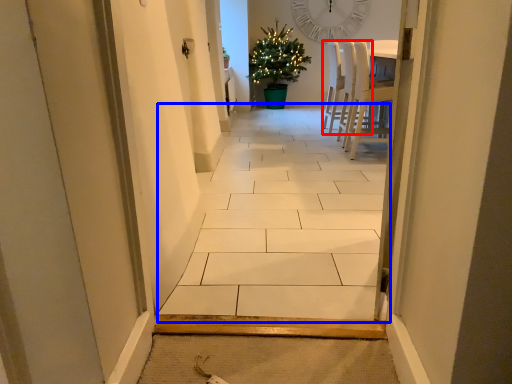
Question: Among these objects, which one is nearest to the camera, chair (highlighted by a red box) or alley (highlighted by a blue box)?

Choices:
 (A) chair
 (B) alley

Answer: (B)